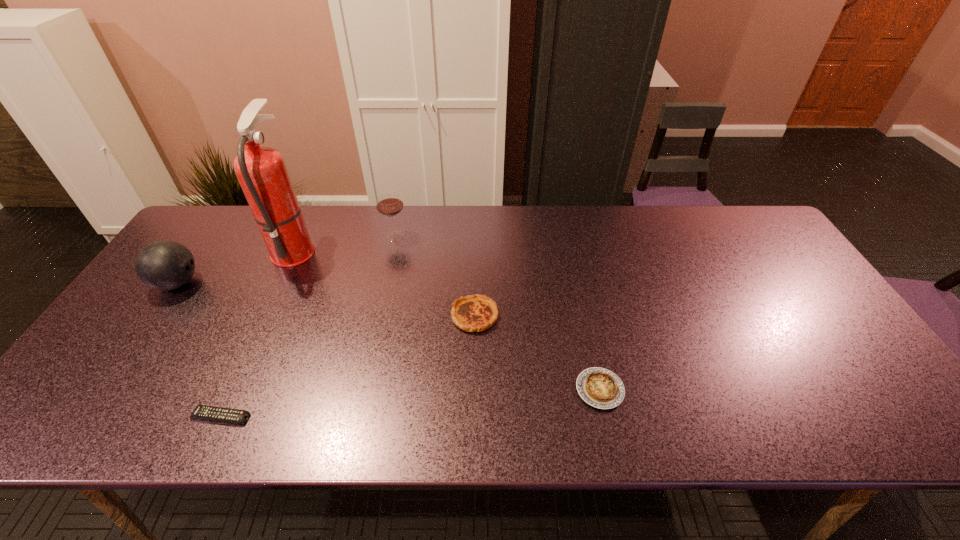
Where is `free space at the near edge`? free space at the near edge is located at coordinates (762, 422).

Identify the location of free space at the left edge of the desktop. (197, 280).

The width and height of the screenshot is (960, 540). I want to click on vacant space at the right edge of the desktop, so click(752, 252).

In the image, there is a desktop. Identify the location of vacant space at the near left corner. (80, 419).

The width and height of the screenshot is (960, 540). Identify the location of free spot between the leftmost object and the remote control. (199, 350).

Where is `free area in between the leftmost object and the nearer quiche`? The image size is (960, 540). free area in between the leftmost object and the nearer quiche is located at coordinates (389, 336).

The image size is (960, 540). In order to click on free space between the shorter quiche and the left quiche in this screenshot , I will do `click(538, 353)`.

Identify the location of unoccupied area between the bowling ball and the fire extinguisher. (236, 266).

Where is `free space between the fire extinguisher and the shorter quiche`? free space between the fire extinguisher and the shorter quiche is located at coordinates (447, 319).

This screenshot has height=540, width=960. I want to click on empty location between the farther quiche and the fifth tallest object, so click(x=538, y=353).